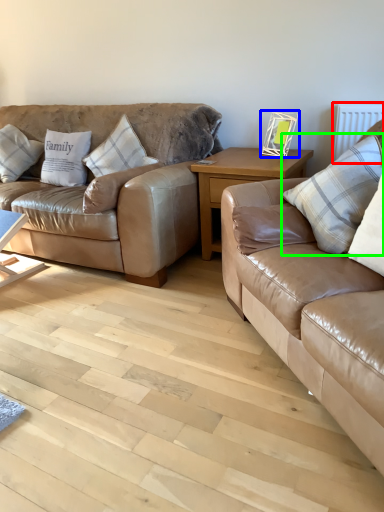
Question: Which object is the farthest from radiator (highlighted by a red box)? Choose among these: picture frame (highlighted by a blue box) or pillow (highlighted by a green box).

Choices:
 (A) picture frame
 (B) pillow

Answer: (B)